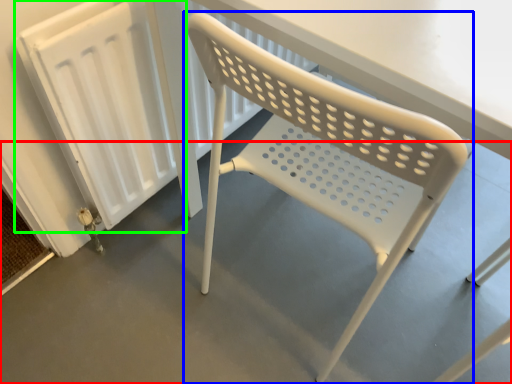
Question: Which object is positioned farthest from concrete (highlighted by a red box)? Select from chair (highlighted by a blue box) and radiator (highlighted by a green box).

Choices:
 (A) chair
 (B) radiator

Answer: (B)